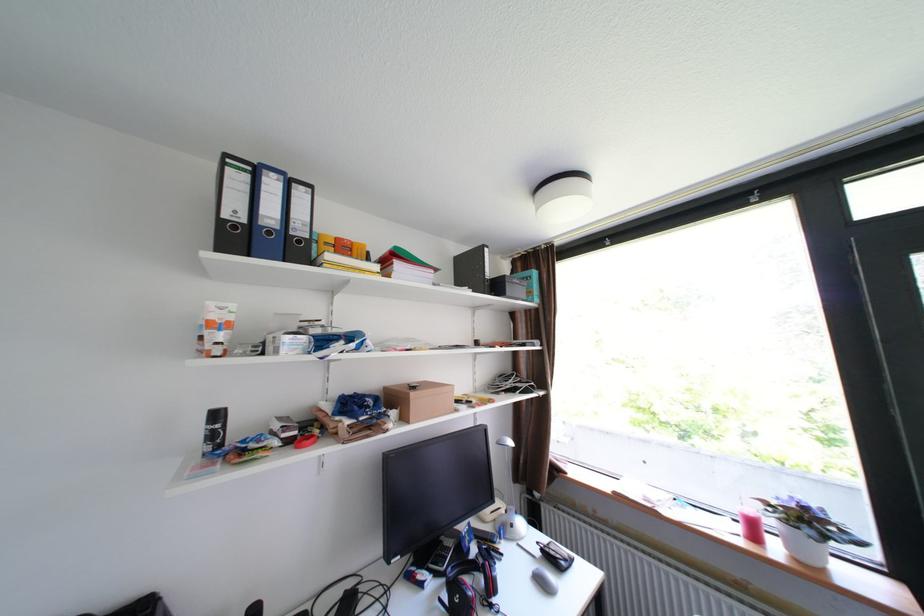
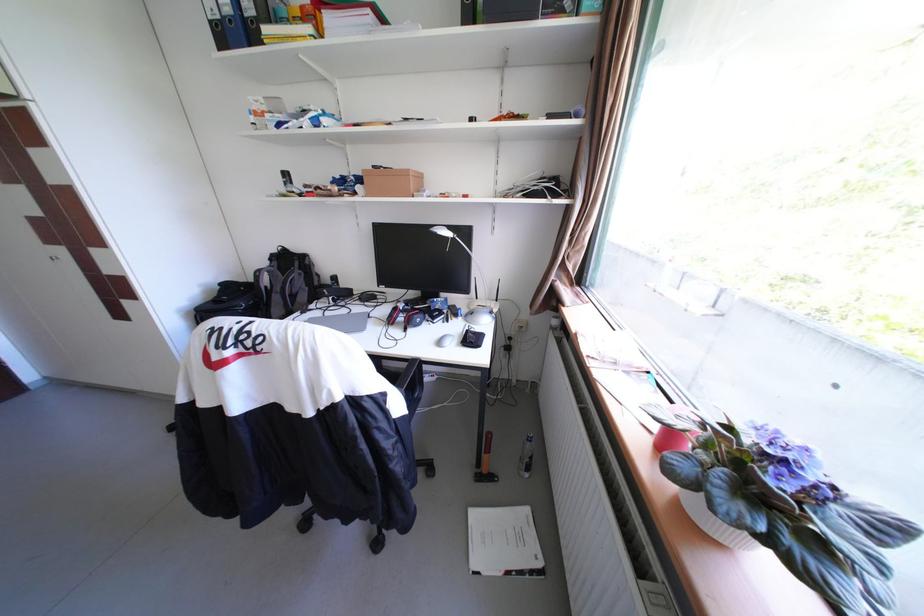
Where in the second image is the point corresponding to point 552,583 from the first image?

(454, 341)